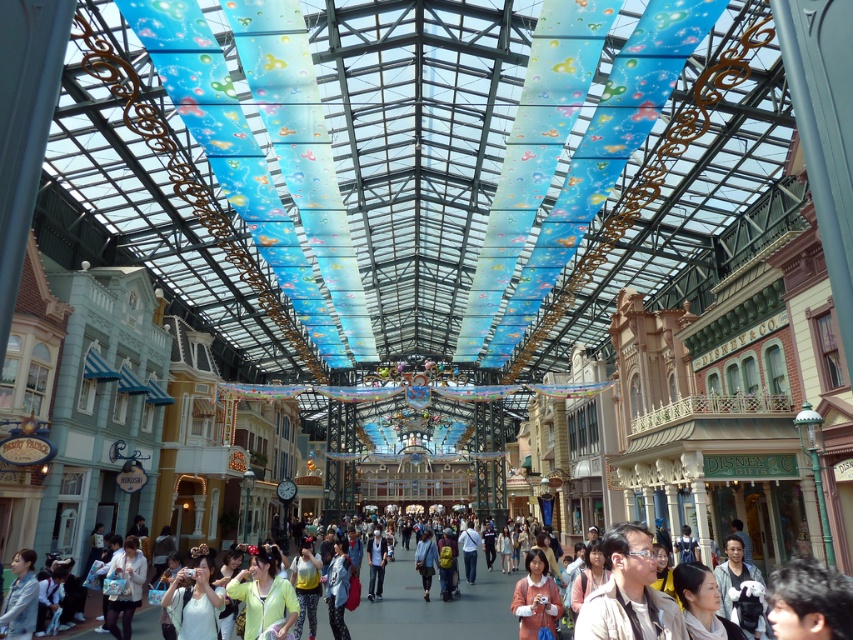
Between light green fabric at center and light blue denim jeans at center, which one has more height?

With more height is light green fabric at center.

Who is more distant from viewer, [457,605] or [370,536]?

Point [370,536]

Image resolution: width=853 pixels, height=640 pixels. Describe the element at coordinates (434, 604) in the screenshot. I see `light green fabric at center` at that location.

In order to click on light green fabric at center in this screenshot , I will do `click(434, 604)`.

Which is below, light green fabric at center or light brown leather jacket at lower right?

light green fabric at center

Which is in front, point (148, 636) or point (672, 637)?

Point (672, 637)

Find the location of `light green fabric at center`. light green fabric at center is located at coordinates (434, 604).

Where is `denim jacket at lower left`? denim jacket at lower left is located at coordinates pos(20,598).

Which is behind, point (32, 596) or point (381, 541)?

The point (381, 541) is behind.

Does point (10, 609) lie behind point (374, 576)?

No, (10, 609) is closer to viewer.

Where is `denim jacket at lower left`? denim jacket at lower left is located at coordinates (20, 598).